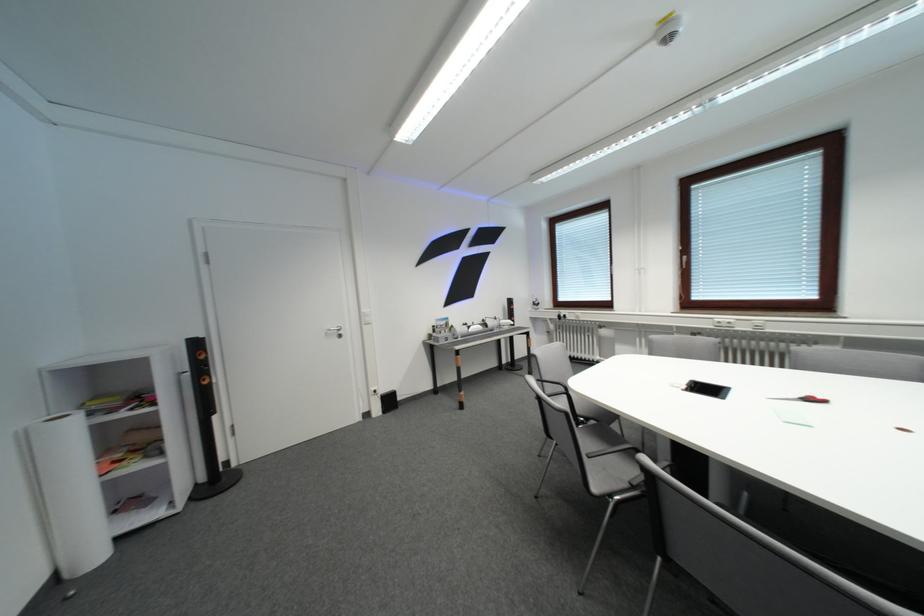
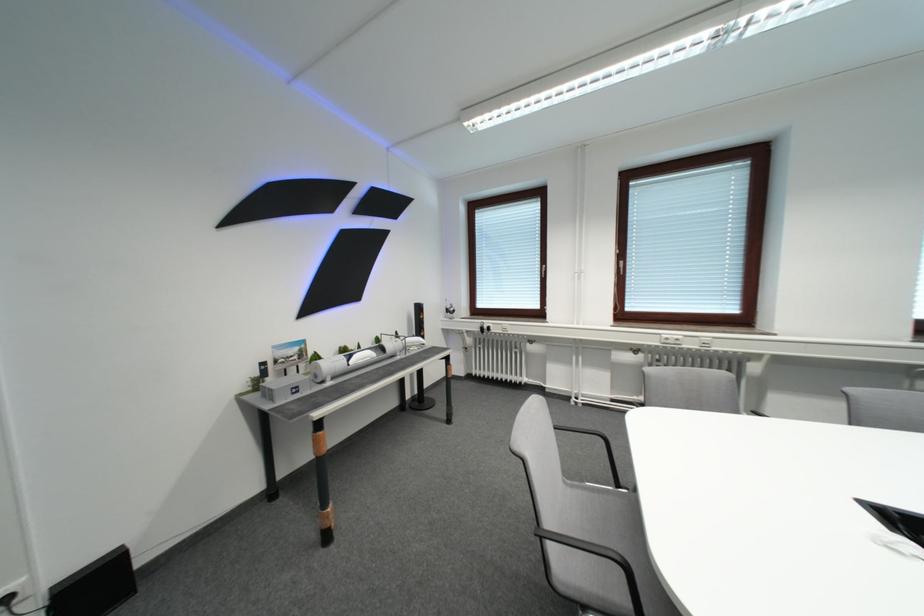
Question: Which direction would the cameraman need to move to produce the second image? Reply with the corresponding letter.

Choices:
 (A) Left
 (B) Right
 (C) Forward
 (D) Backward

Answer: (C)